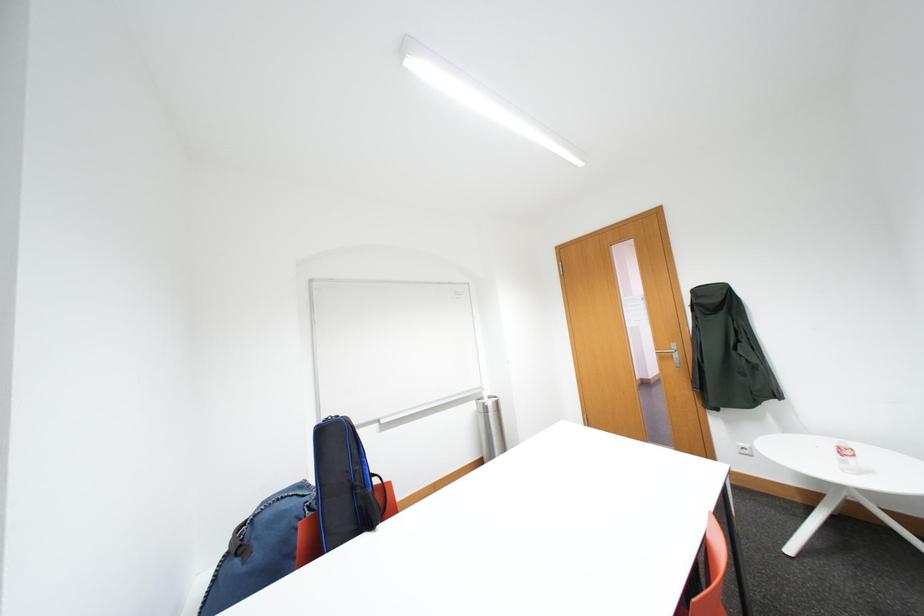
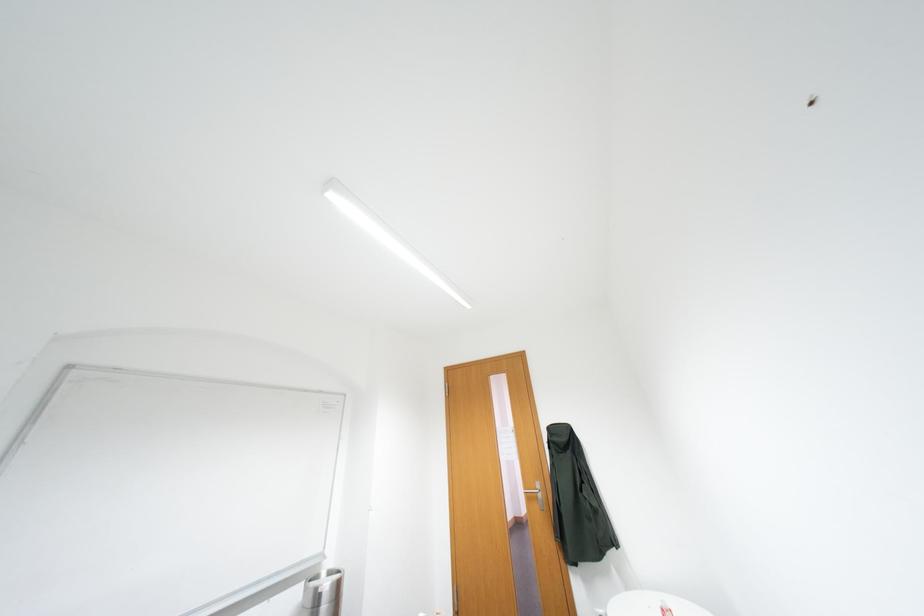
Based on the continuous images, in which direction is the camera rotating?

The camera's rotation is toward right-up.